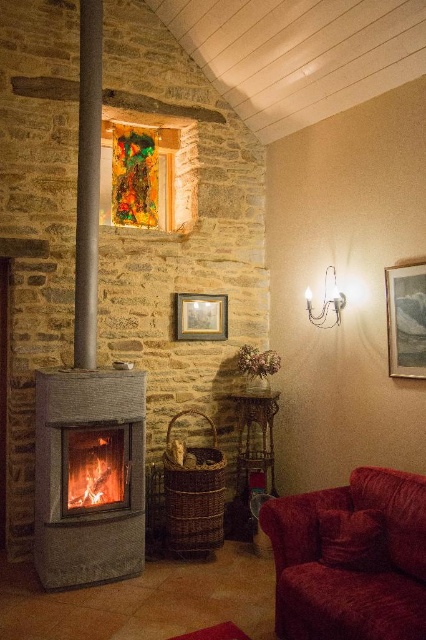
You are planning to place a new coffee table in the living room. The coffee table you have is the same size as the smooth gray beam at left. Will it fit in the space where the velvet red couch at lower right is currently located?

The velvet red couch at lower right is larger in size than the smooth gray beam at left. Since the coffee table is the same size as the beam, it will fit in the space where the couch is located because the couch takes up more space.

You are a painter planning to hang a large painting on the wall. You have two options for placement either above the matte gray fireplace at left or above the orange glowing wood at center. Based on their sizes, which location would provide enough space for the painting?

The matte gray fireplace at left is much taller than the orange glowing wood at center, so hanging the painting above the matte gray fireplace at left would provide more vertical space and be the better option.